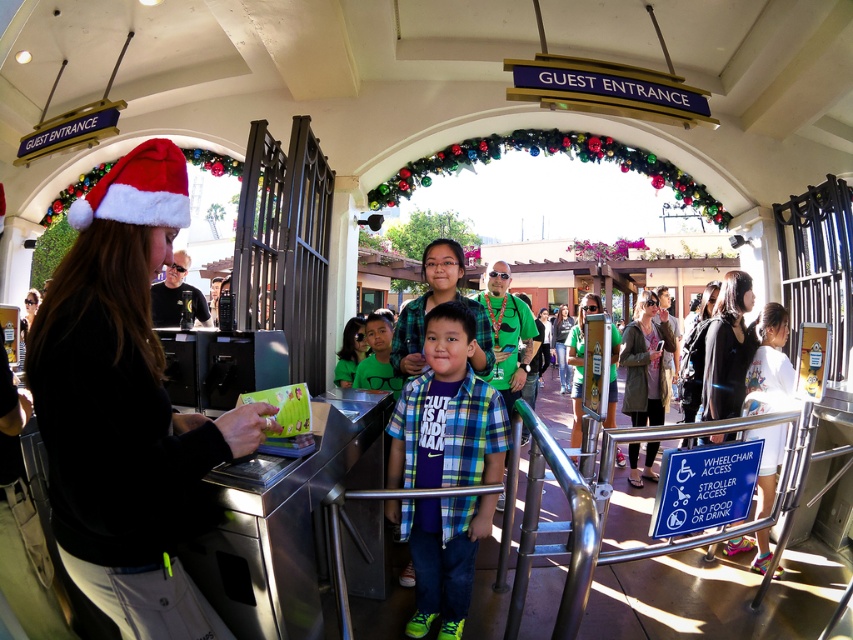
Question: Does santa hat at center appear on the right side of plaid shirt at center?

Choices:
 (A) yes
 (B) no

Answer: (B)

Question: Which point is closer to the camera?

Choices:
 (A) (166, 534)
 (B) (422, 438)

Answer: (A)

Question: Is santa hat at center bigger than plaid shirt at center?

Choices:
 (A) yes
 (B) no

Answer: (B)

Question: Does santa hat at center appear under plaid shirt at center?

Choices:
 (A) yes
 (B) no

Answer: (B)

Question: Which point is closer to the camera?

Choices:
 (A) (28, 381)
 (B) (440, 529)

Answer: (A)